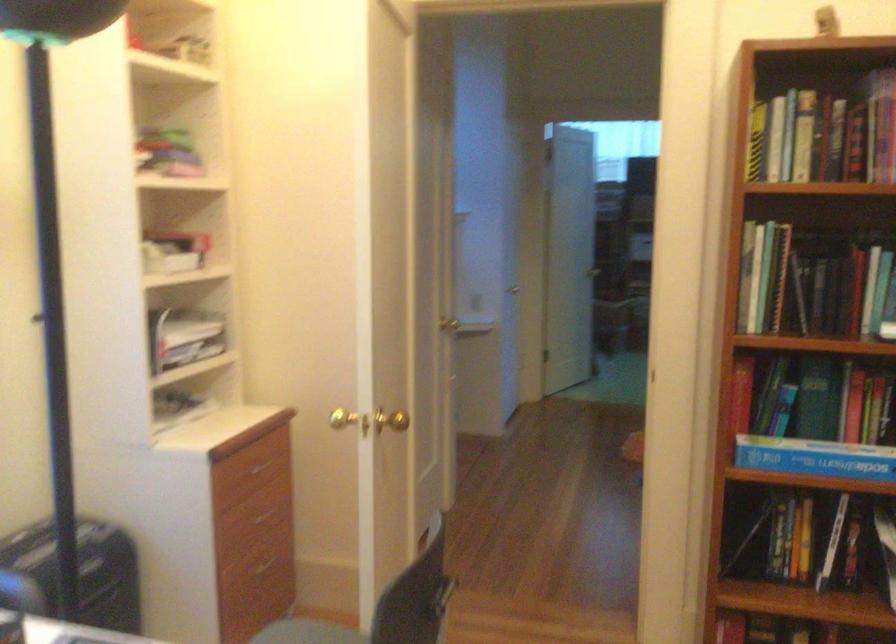
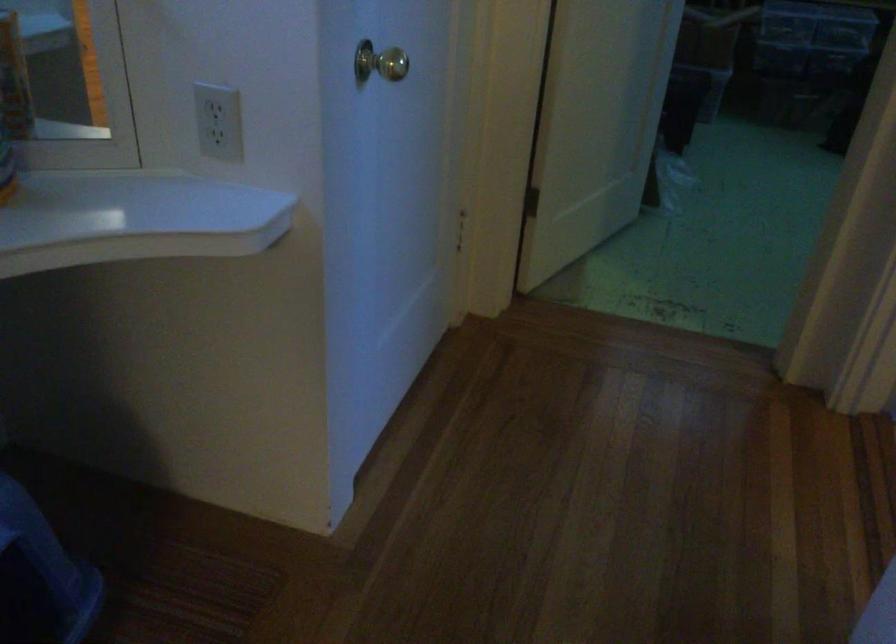
Question: What movement of the cameraman would produce the second image?

Choices:
 (A) Left
 (B) Right
 (C) Forward
 (D) Backward

Answer: (C)